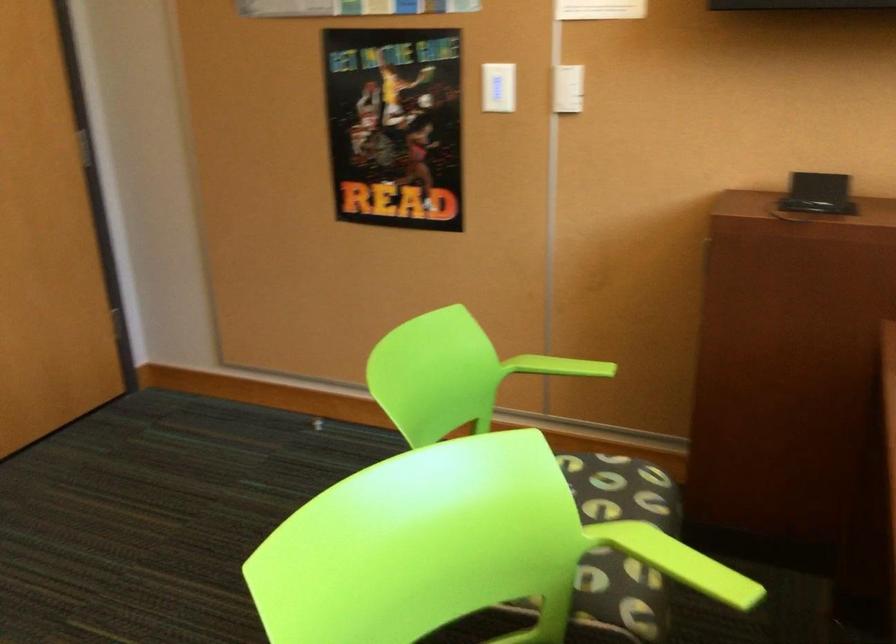
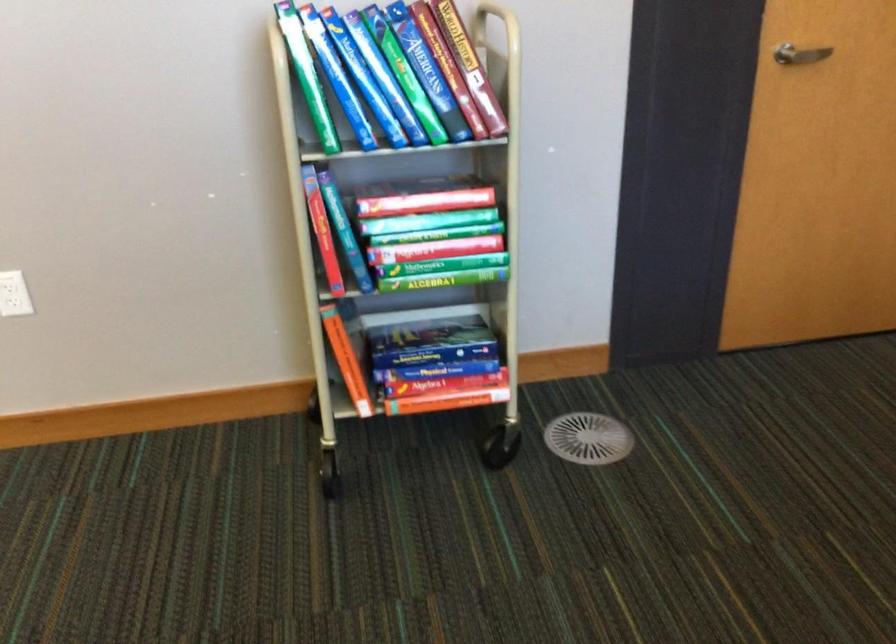
First-person continuous shooting, in which direction is the camera rotating?

The camera's rotation is toward left-down.